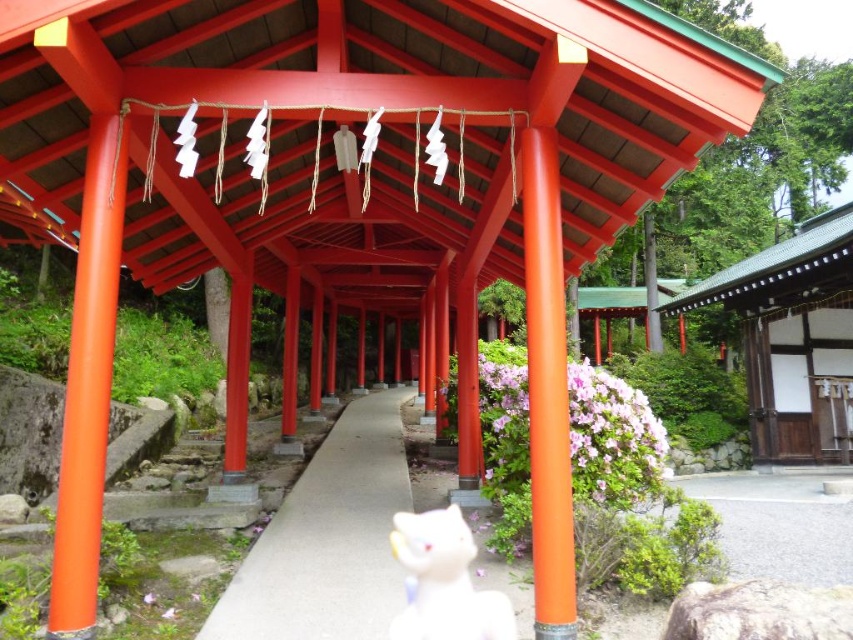
Question: Does concrete at center have a greater width compared to white glossy cat at center?

Choices:
 (A) no
 (B) yes

Answer: (B)

Question: Is concrete at center positioned before white glossy cat at center?

Choices:
 (A) no
 (B) yes

Answer: (A)

Question: Among these points, which one is farthest from the camera?

Choices:
 (A) (312, 512)
 (B) (781, 419)
 (C) (399, 550)

Answer: (B)

Question: In this image, where is green shingled roof at upper right located relative to white glossy cat at center?

Choices:
 (A) left
 (B) right

Answer: (B)

Question: Among these objects, which one is nearest to the camera?

Choices:
 (A) concrete at center
 (B) green shingled roof at upper right
 (C) white glossy cat at center

Answer: (C)

Question: Which point is closer to the camera?

Choices:
 (A) click(x=428, y=634)
 (B) click(x=383, y=484)

Answer: (A)